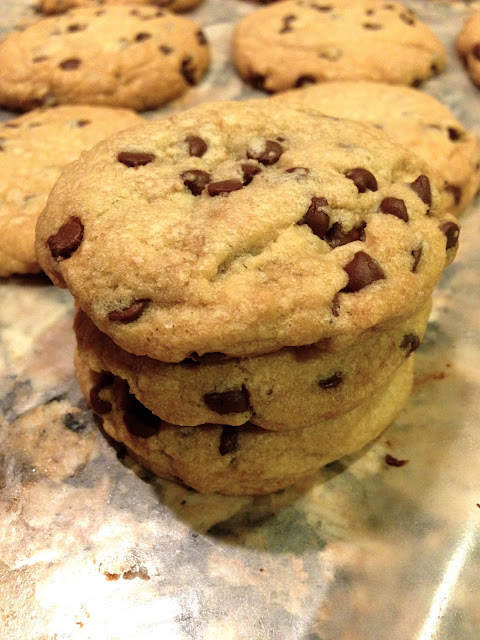
Find the location of a particular element. The height and width of the screenshot is (640, 480). green leaves on counter is located at coordinates (293, 525), (301, 532), (379, 505), (234, 596), (190, 555), (138, 493).